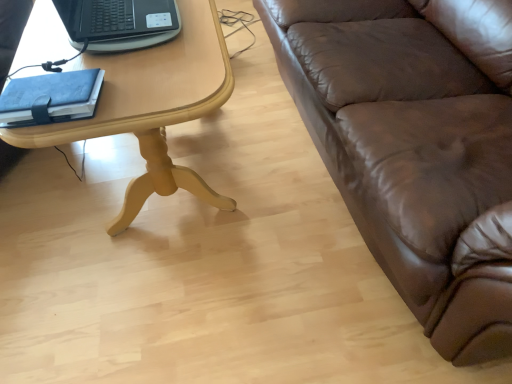
Question: Is black plastic laptop at upper left next to blue leather notebook at left and touching it?

Choices:
 (A) no
 (B) yes

Answer: (A)

Question: Can you confirm if black plastic laptop at upper left is wider than blue leather notebook at left?

Choices:
 (A) no
 (B) yes

Answer: (B)

Question: Is black plastic laptop at upper left smaller than blue leather notebook at left?

Choices:
 (A) no
 (B) yes

Answer: (A)

Question: Is black plastic laptop at upper left looking in the opposite direction of blue leather notebook at left?

Choices:
 (A) yes
 (B) no

Answer: (B)

Question: Does black plastic laptop at upper left have a greater height compared to blue leather notebook at left?

Choices:
 (A) yes
 (B) no

Answer: (A)

Question: Is the position of black plastic laptop at upper left less distant than that of blue leather notebook at left?

Choices:
 (A) no
 (B) yes

Answer: (A)

Question: Considering the relative sizes of blue leather notebook at left and light wood/yellowishmaterial/texture table at left in the image provided, is blue leather notebook at left shorter than light wood/yellowishmaterial/texture table at left?

Choices:
 (A) yes
 (B) no

Answer: (A)

Question: Is light wood/yellowishmaterial/texture table at left a part of blue leather notebook at left?

Choices:
 (A) yes
 (B) no

Answer: (B)

Question: From a real-world perspective, is blue leather notebook at left under light wood/yellowishmaterial/texture table at left?

Choices:
 (A) no
 (B) yes

Answer: (A)

Question: Is blue leather notebook at left far away from light wood/yellowishmaterial/texture table at left?

Choices:
 (A) no
 (B) yes

Answer: (A)

Question: Can you confirm if blue leather notebook at left is thinner than light wood/yellowishmaterial/texture table at left?

Choices:
 (A) yes
 (B) no

Answer: (A)

Question: Is blue leather notebook at left not inside light wood/yellowishmaterial/texture table at left?

Choices:
 (A) yes
 (B) no

Answer: (A)

Question: Is black plastic laptop at upper left oriented away from brown leather couch at right?

Choices:
 (A) no
 (B) yes

Answer: (B)